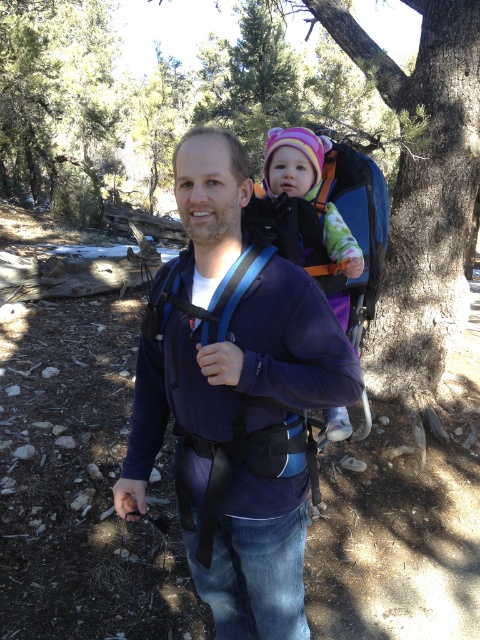
Question: Can you confirm if green leafy tree at upper left is positioned to the right of multicolored fleece hat at center?

Choices:
 (A) yes
 (B) no

Answer: (B)

Question: From the image, what is the correct spatial relationship of blue fleece jacket at center in relation to green leafy tree at upper left?

Choices:
 (A) left
 (B) right

Answer: (B)

Question: Which point appears farthest from the camera in this image?

Choices:
 (A) (189, 248)
 (B) (308, 177)
 (C) (81, 20)

Answer: (C)

Question: Which point is farther from the camera taking this photo?

Choices:
 (A) (269, 168)
 (B) (207, 360)

Answer: (A)

Question: Is blue fleece jacket at center above multicolored fleece hat at center?

Choices:
 (A) yes
 (B) no

Answer: (B)

Question: Which of the following is the closest to the observer?

Choices:
 (A) multicolored fleece hat at center
 (B) green leafy tree at upper left
 (C) blue fleece jacket at center

Answer: (C)